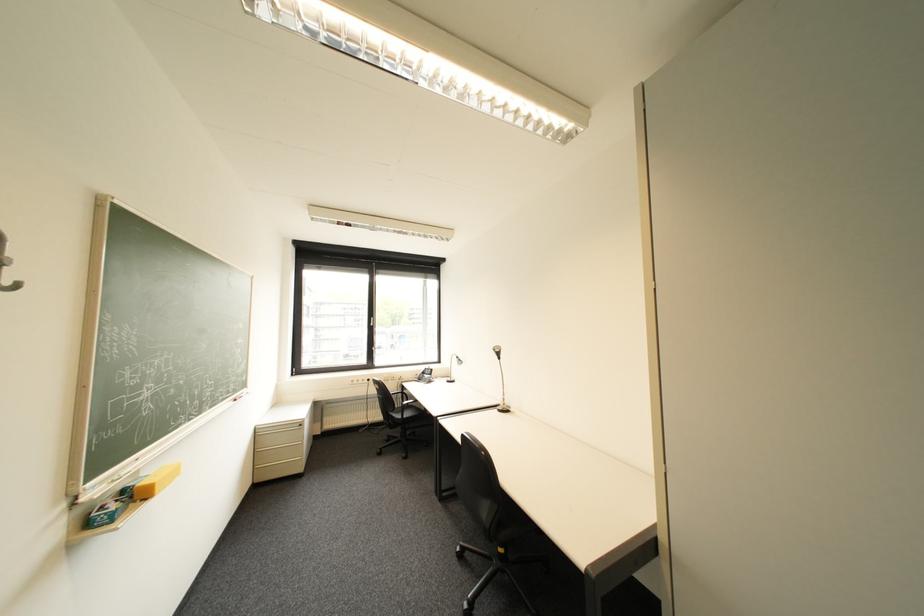
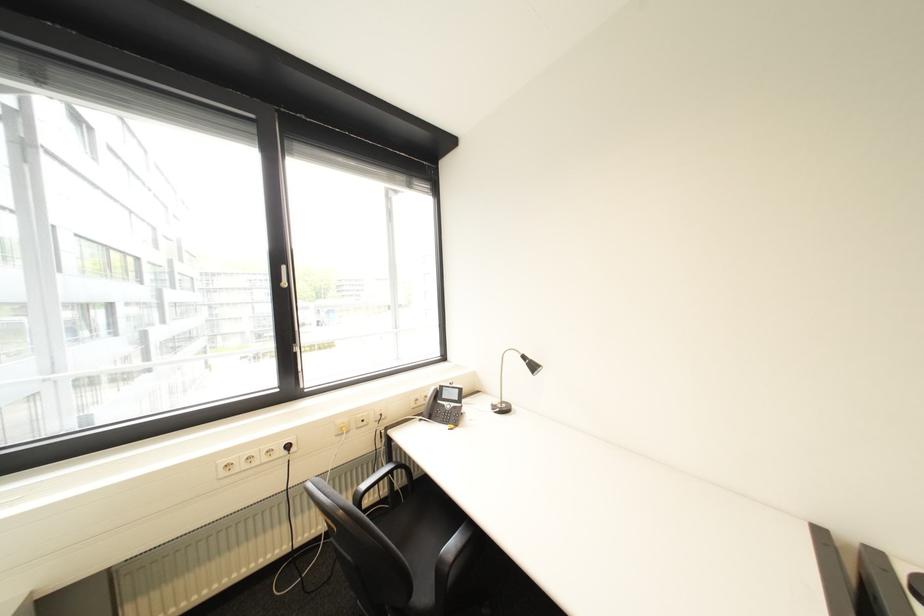
What movement of the cameraman would produce the second image?

The movement direction of the cameraman is left, forward.